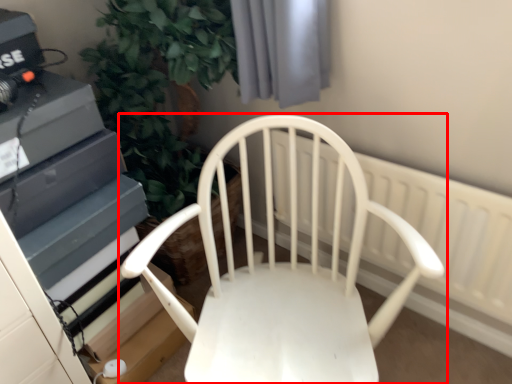
Question: Considering the relative positions of chair (annotated by the red box) and radiator in the image provided, where is chair (annotated by the red box) located with respect to the staircase?

Choices:
 (A) left
 (B) right

Answer: (A)